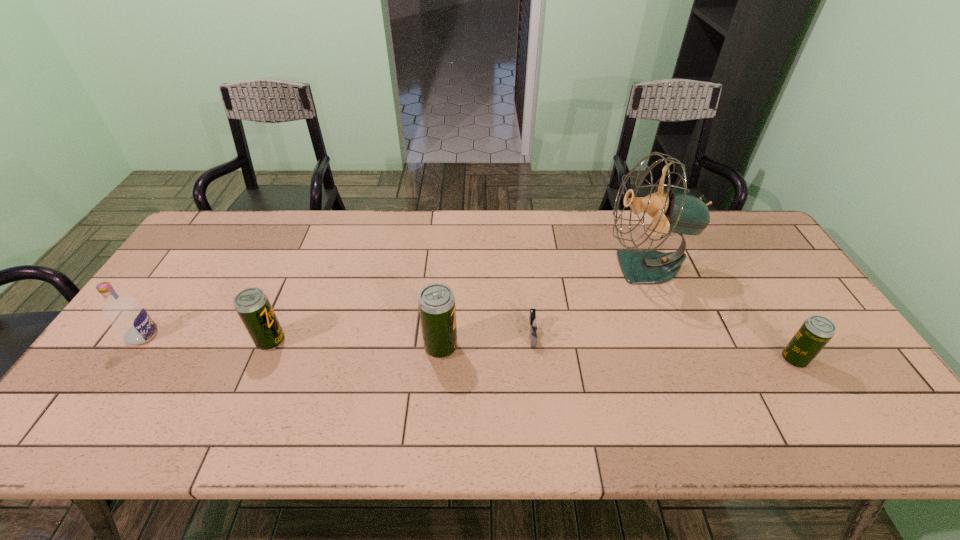
Identify the location of object present at the right edge. (816, 331).

In the image, there is a desktop. Where is `vacant space at the far edge`? vacant space at the far edge is located at coordinates (666, 250).

Image resolution: width=960 pixels, height=540 pixels. What are the coordinates of `vacant space at the near edge of the desktop` in the screenshot? It's located at (685, 378).

The height and width of the screenshot is (540, 960). Identify the location of free space at the left edge of the desktop. (153, 353).

The height and width of the screenshot is (540, 960). I want to click on blank area at the right edge, so click(x=769, y=278).

Image resolution: width=960 pixels, height=540 pixels. Identify the location of blank space at the far right corner of the desktop. (756, 234).

I want to click on vacant point located between the second shortest beer can and the fifth tallest object, so click(x=533, y=350).

Where is `free space between the third object from right to left and the fourth object from right to left`? This screenshot has height=540, width=960. free space between the third object from right to left and the fourth object from right to left is located at coordinates (487, 341).

Identify the location of vacant space that is in between the leftmost object and the second object from left to right. This screenshot has width=960, height=540. (207, 338).

This screenshot has height=540, width=960. I want to click on free spot between the leftmost object and the tallest object, so click(x=395, y=301).